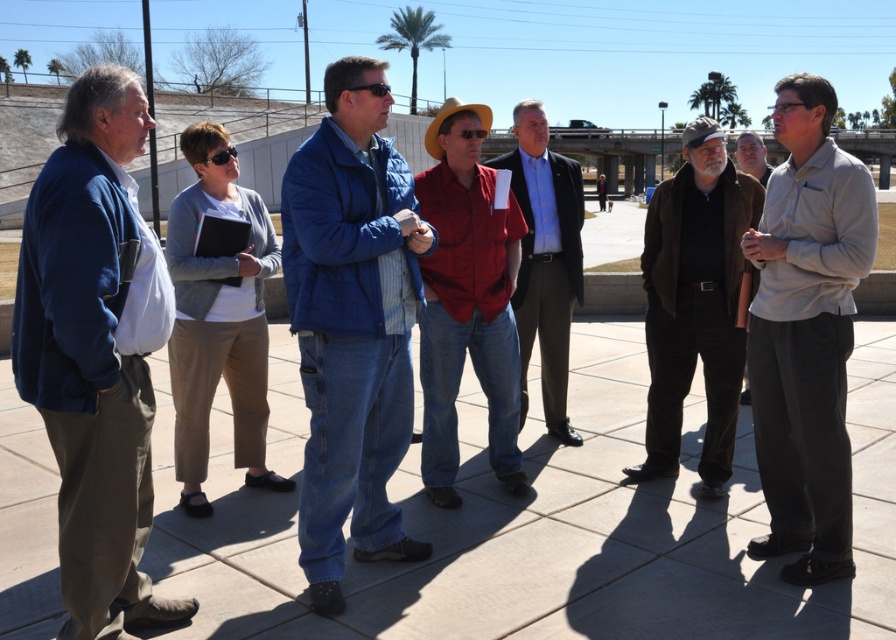
You are a photographer trying to capture a clear shot of the dark brown leather jacket at center without the red denim jeans at center blocking it. Based on the scene description, is this possible?

The red denim jeans at center is positioned over dark brown leather jacket at center, so the jacket is completely or partially hidden by the jeans. Therefore, it might not be possible to capture a clear shot of the dark brown leather jacket at center without the red denim jeans at center blocking it.

Looking at this image, you are standing in the group and want to pass a document to the person wearing the dark brown leather jacket at center without walking around anyone. Since the red denim jeans at center is blocking your path, can you reach them by moving to your right?

Yes, you can reach the dark brown leather jacket at center by moving to your right because the red denim jeans at center is to the left of them, so moving right would allow you to bypass the obstruction.

You are a photographer trying to capture a photo of the group. You notice the gray cotton shirt at center and the dark brown leather jacket at center. Which clothing item should you focus on to ensure it appears higher in the frame?

The gray cotton shirt at center is above the dark brown leather jacket at center, so focusing on it will ensure it appears higher in the frame.